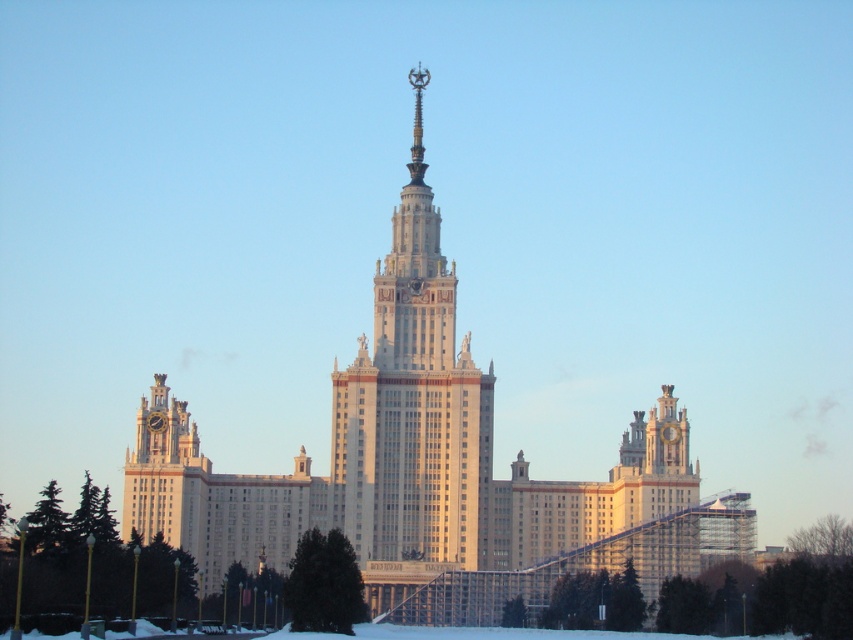
You are standing at the point indicated by point (432, 470). What is the most prominent structure directly in front of you?

The point (432, 470) indicates the white stone building at center, which is the most prominent structure directly in front of you.

You are an architect examining the grand structure. You notice the white stone building at center and the white marble tower at center. Which one is located below the other?

The white stone building at center is positioned under the white marble tower at center, meaning the building is below the tower.

You are standing at the entrance of the university campus and want to take a photo of the white stone building at center. If your camera can only capture objects within a 500 meter radius, will you be able to take the photo from your current position?

The white stone building at center is located at point [432,470]. Since the coordinates are within the camera range, you can take the photo from your current position.